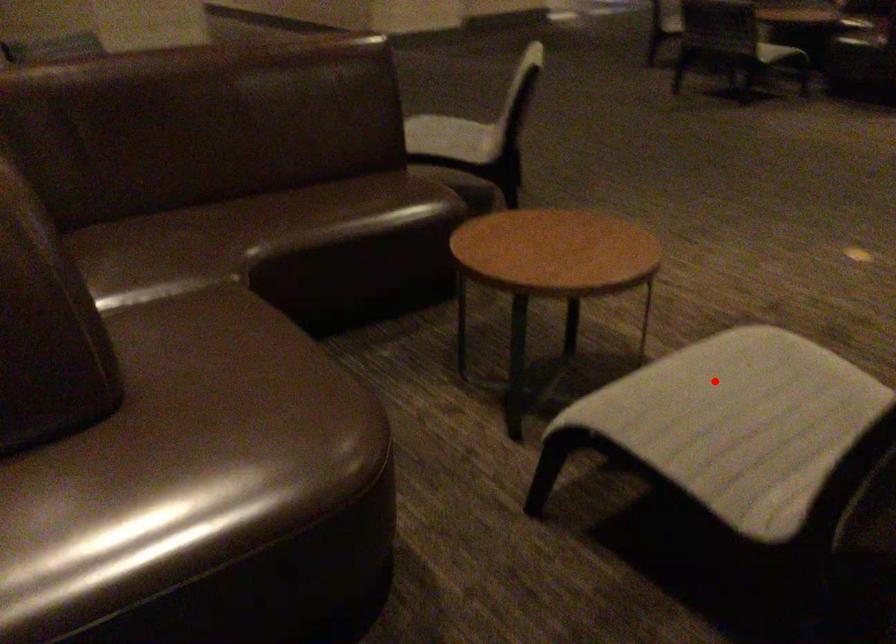
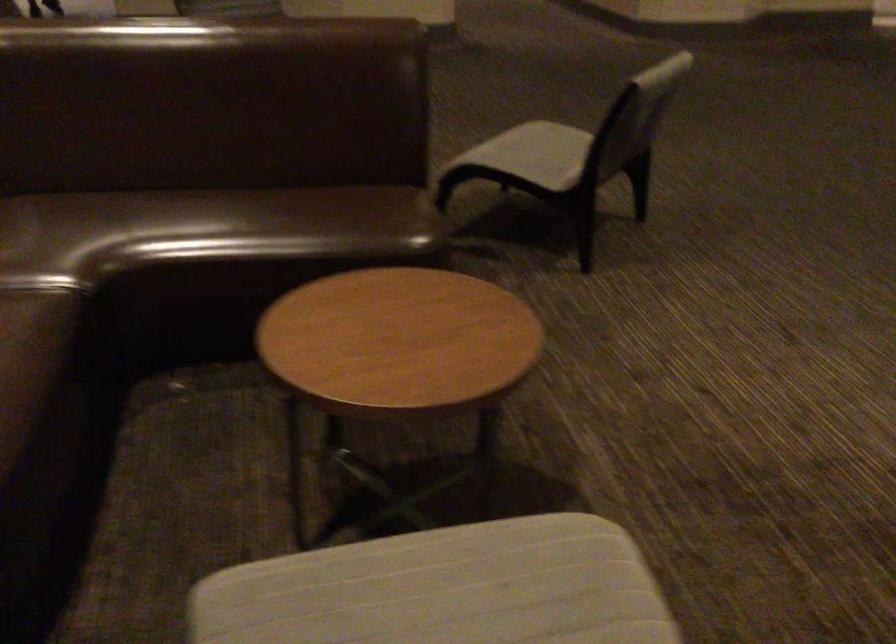
The point at the highlighted location is marked in the first image. Where is the corresponding point in the second image?

(444, 589)